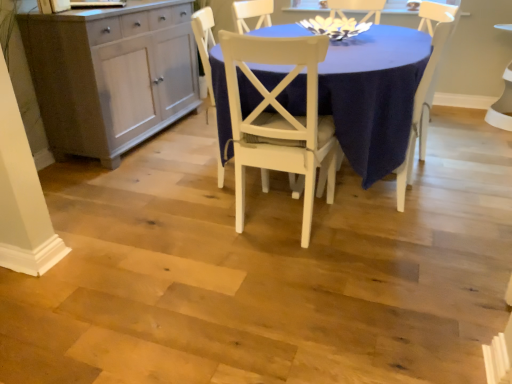
Question: From a real-world perspective, is matte gray cabinet at left physically located above or below white wood chair at center, arranged as the third chair when viewed from the right?

Choices:
 (A) below
 (B) above

Answer: (B)

Question: From the image's perspective, is matte gray cabinet at left above or below white wood chair at center, arranged as the third chair when viewed from the right?

Choices:
 (A) above
 (B) below

Answer: (A)

Question: Based on their relative distances, which object is farther from the matte gray cabinet at left?

Choices:
 (A) matte white table at center
 (B) white wood chair at center, which ranks as the first chair in right-to-left order
 (C) white wood chair at center, which ranks as the first chair in left-to-right order
 (D) white matte chair at center, which is the 2th chair in left-to-right order

Answer: (B)

Question: Based on their relative distances, which object is nearer to the white wood chair at center, which ranks as the first chair in left-to-right order?

Choices:
 (A) matte white table at center
 (B) white matte chair at center, positioned as the second chair in right-to-left order
 (C) white wood chair at center, which ranks as the first chair in right-to-left order
 (D) matte gray cabinet at left

Answer: (B)